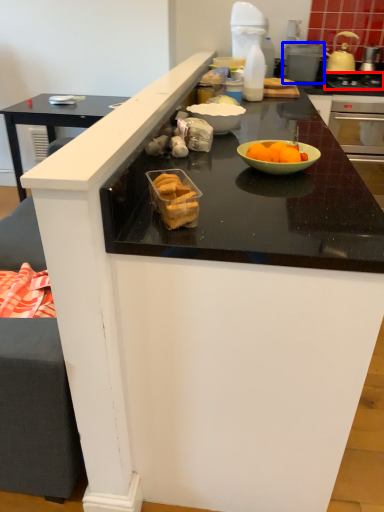
Question: Which of the following is the closest to the observer, gas stove (highlighted by a red box) or appliance (highlighted by a blue box)?

Choices:
 (A) gas stove
 (B) appliance

Answer: (A)